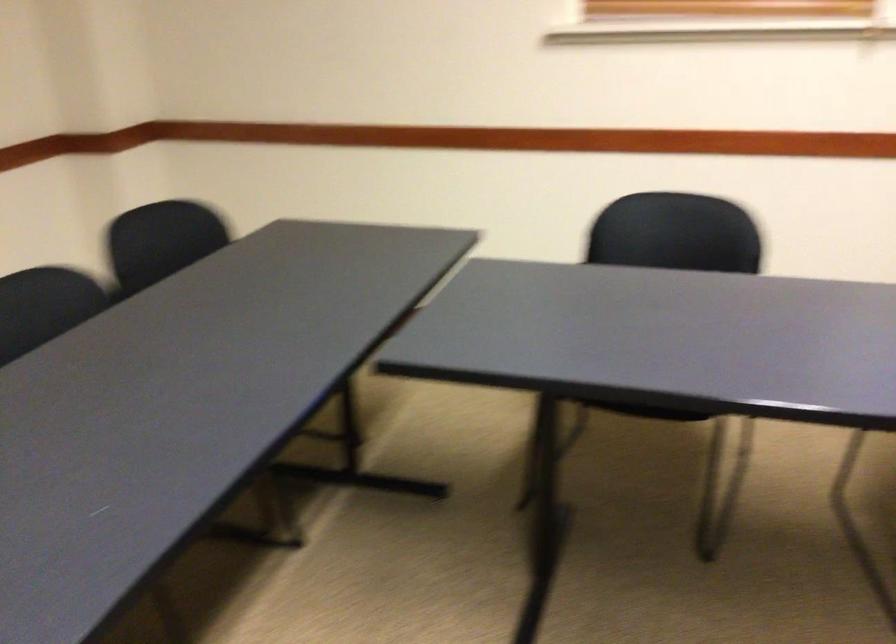
Find where to sit the black chair sitting surface. Please return your answer as a coordinate pair (x, y).

(672, 223)